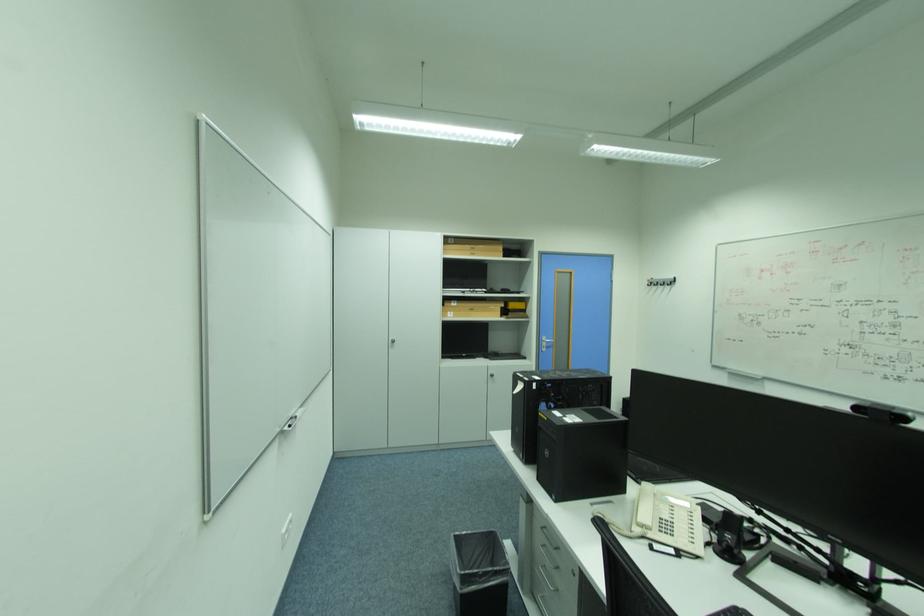
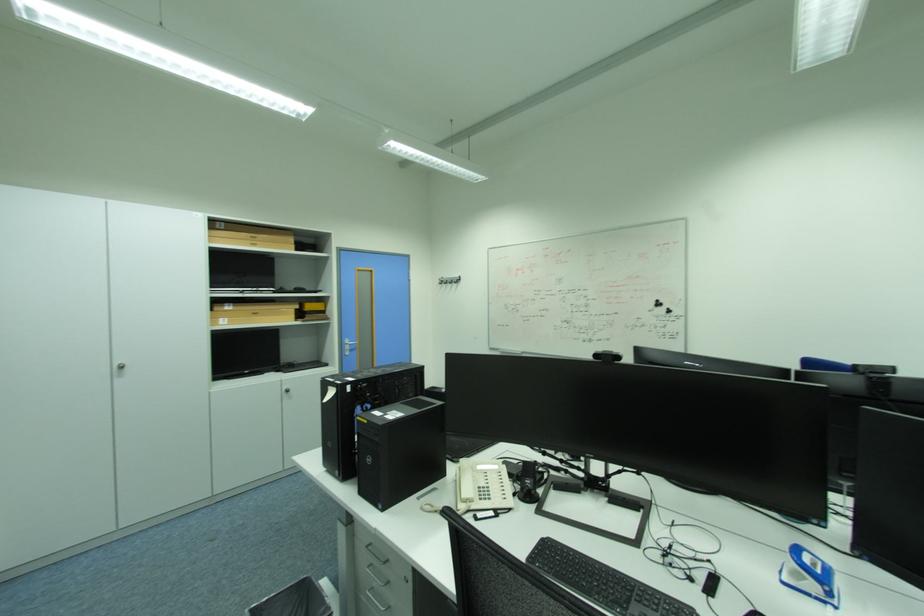
Find the pixel in the second image that matches (400,347) in the first image.

(128, 376)